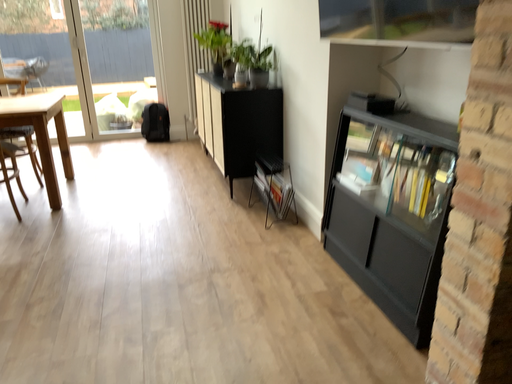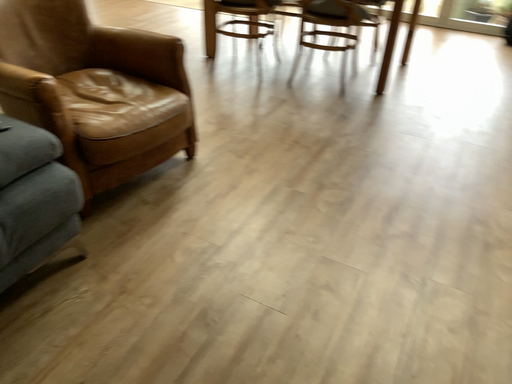
Question: Which way did the camera rotate in the video?

Choices:
 (A) rotated upward
 (B) rotated downward

Answer: (B)